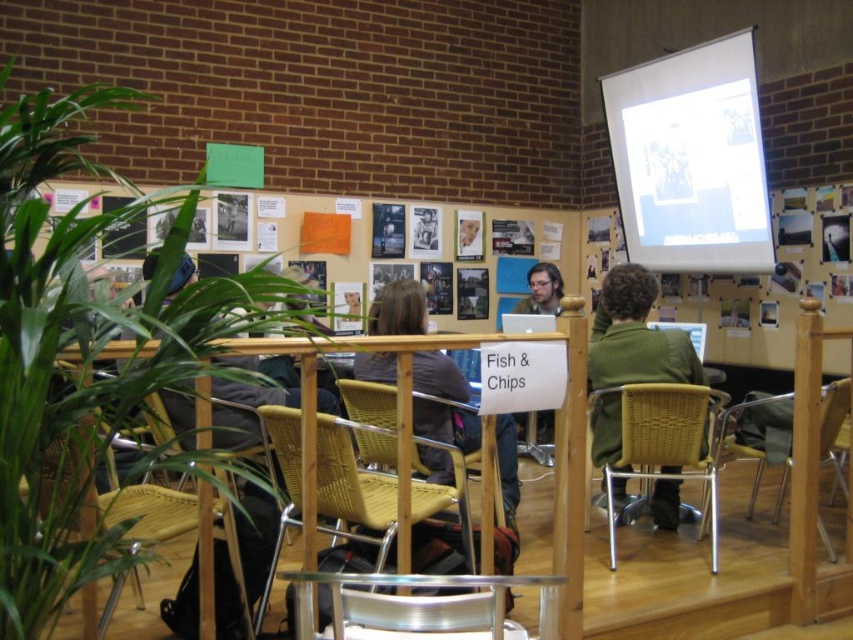
You are organizing a workshop and need to hand out a document. You see the white paper at upper center and the woven wicker chair at lower right. Which object is located higher up in the image?

The white paper at upper center is above the woven wicker chair at lower right, so it is higher up in the image.

You are a person carrying a large box that is 1.5 meters long. You are standing in the room and want to place the box on the floor near the clear plastic chair at lower center. Is there enough space between you and the chair to maneuver the box without bumping into anything?

The distance between you and the clear plastic chair at lower center is 1.25 meters. Since the box is 1.5 meters long, there isn t enough space to maneuver it without bumping into something. You might need to move closer to the chair or find a wider area.

You are organizing a small event and need to seat guests. You have a clear plastic chair at lower center and a green knitted sweater at center. Which object can accommodate a person sitting on it?

The clear plastic chair at lower center can accommodate a person sitting on it, as it is a chair designed for seating, while the green knitted sweater at center is an item meant for wearing, not sitting.